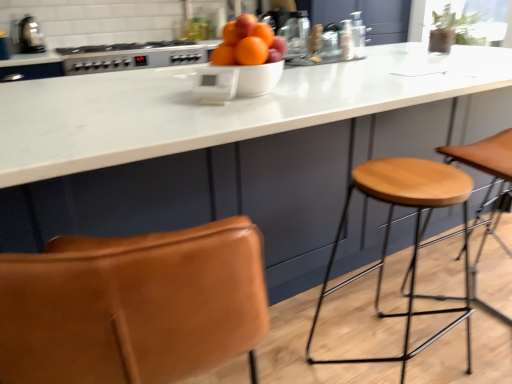
Question: From the image's perspective, relative to white plastic thermostat at center, placed as the second appliance when sorted from left to right, is white glossy bowl at center above or below?

Choices:
 (A) below
 (B) above

Answer: (B)

Question: Considering the positions of white glossy bowl at center and white plastic thermostat at center, the 1th appliance in the bottom-to-top sequence, in the image, is white glossy bowl at center wider or thinner than white plastic thermostat at center, the 1th appliance in the bottom-to-top sequence,?

Choices:
 (A) thin
 (B) wide

Answer: (B)

Question: Based on their relative distances, which object is farther from the light brown wood stool at right?

Choices:
 (A) wooden seat at right
 (B) matte white bowl at center
 (C) white plastic thermostat at center, placed as the second appliance when sorted from top to bottom
 (D) metallic silver toaster at upper left, arranged as the 2th appliance when viewed from the front
 (E) satin silver gas stove at upper center

Answer: (D)

Question: Which object is positioned farthest from the matte white bowl at center?

Choices:
 (A) light brown wood stool at right
 (B) wooden seat at right
 (C) white glossy bowl at center
 (D) metallic silver toaster at upper left, which is the 1th appliance in top-to-bottom order
 (E) satin silver gas stove at upper center

Answer: (D)